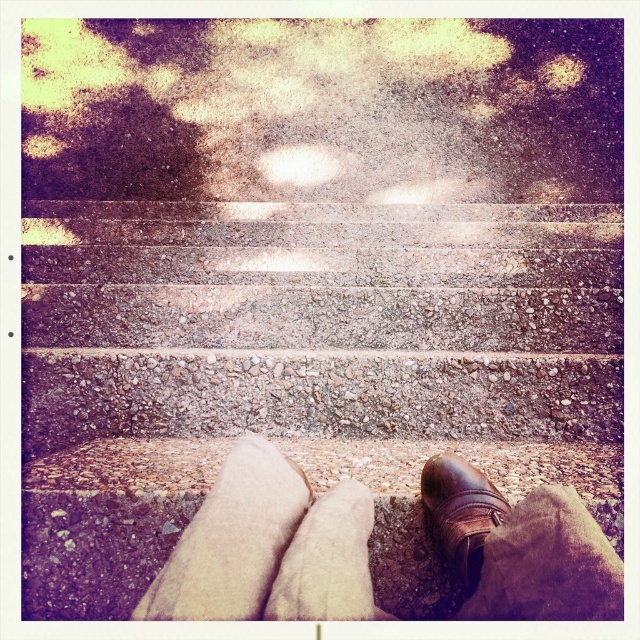
Question: Which object appears farthest from the camera in this image?

Choices:
 (A) beige wool sock at lower center
 (B) concrete textured stairs at center

Answer: (B)

Question: Is concrete textured stairs at center to the right of brown leather shoe at lower center from the viewer's perspective?

Choices:
 (A) yes
 (B) no

Answer: (B)

Question: Estimate the real-world distances between objects in this image. Which object is farther from the beige suede foot at lower center?

Choices:
 (A) beige wool sock at lower center
 (B) brown leather shoe at lower center
 (C) concrete textured stairs at center

Answer: (C)

Question: Does beige wool sock at lower center have a greater width compared to brown leather shoe at lower center?

Choices:
 (A) yes
 (B) no

Answer: (B)

Question: Is beige suede foot at lower center wider than beige wool sock at lower center?

Choices:
 (A) no
 (B) yes

Answer: (B)

Question: Which point appears closest to the camera in this image?

Choices:
 (A) (236, 492)
 (B) (342, 618)
 (C) (88, 580)
 (D) (445, 497)

Answer: (B)